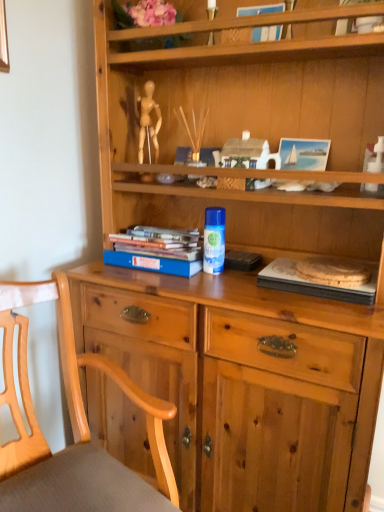
Question: Is blue hardcover book at upper center positioned before white plastic toy at upper right?

Choices:
 (A) no
 (B) yes

Answer: (A)

Question: Would you say white plastic toy at upper right is part of blue hardcover book at upper center's contents?

Choices:
 (A) no
 (B) yes

Answer: (A)

Question: From a real-world perspective, is blue hardcover book at upper center positioned over white plastic toy at upper right based on gravity?

Choices:
 (A) yes
 (B) no

Answer: (A)

Question: Is blue hardcover book at upper center shorter than white plastic toy at upper right?

Choices:
 (A) yes
 (B) no

Answer: (A)

Question: Considering the relative sizes of blue hardcover book at upper center and white plastic toy at upper right in the image provided, is blue hardcover book at upper center thinner than white plastic toy at upper right?

Choices:
 (A) no
 (B) yes

Answer: (B)

Question: Considering the relative sizes of blue hardcover book at upper center and white plastic toy at upper right in the image provided, is blue hardcover book at upper center bigger than white plastic toy at upper right?

Choices:
 (A) yes
 (B) no

Answer: (A)

Question: Is wooden chair at lower left next to blue hardcover book at upper center and touching it?

Choices:
 (A) no
 (B) yes

Answer: (A)

Question: Is wooden chair at lower left positioned beyond the bounds of blue hardcover book at upper center?

Choices:
 (A) yes
 (B) no

Answer: (A)

Question: From the image's perspective, is wooden chair at lower left below blue hardcover book at upper center?

Choices:
 (A) yes
 (B) no

Answer: (A)

Question: Can you confirm if wooden chair at lower left is taller than blue hardcover book at upper center?

Choices:
 (A) yes
 (B) no

Answer: (A)

Question: Does wooden chair at lower left have a lesser width compared to blue hardcover book at upper center?

Choices:
 (A) yes
 (B) no

Answer: (B)

Question: Does wooden chair at lower left have a greater width compared to blue hardcover book at upper center?

Choices:
 (A) no
 (B) yes

Answer: (B)

Question: Does hardcover books at left, which ranks as the 1th paperback book in left-to-right order, have a lesser width compared to white plastic toy at upper right?

Choices:
 (A) no
 (B) yes

Answer: (A)